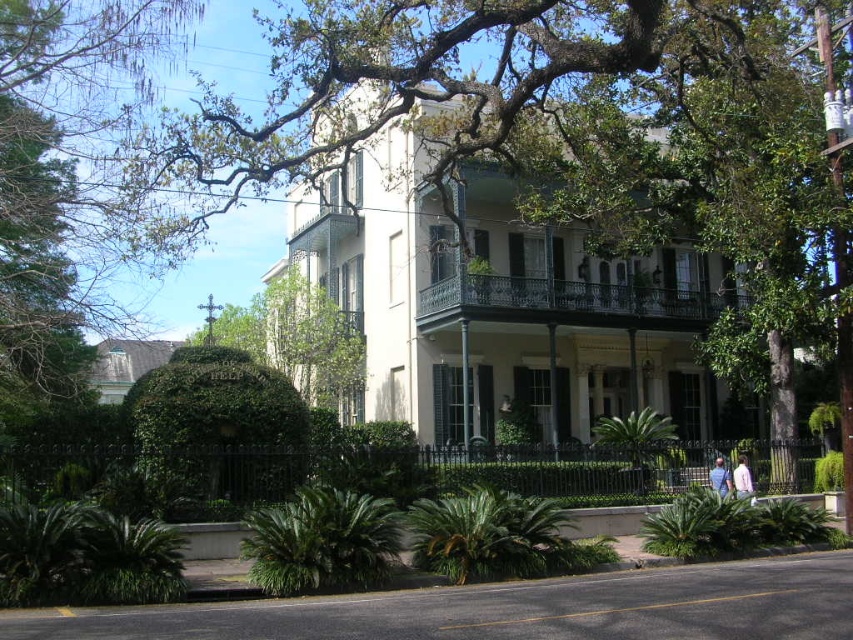
Question: Is dark green wrought iron porch at center positioned before pink fabric shirt at lower right?

Choices:
 (A) no
 (B) yes

Answer: (A)

Question: Can you confirm if dark green wrought iron porch at center is wider than pink fabric shirt at lower right?

Choices:
 (A) no
 (B) yes

Answer: (B)

Question: From the image, what is the correct spatial relationship of green leafy tree at center in relation to blue denim jacket at lower right?

Choices:
 (A) right
 (B) left

Answer: (B)

Question: Which object appears farthest from the camera in this image?

Choices:
 (A) blue denim jacket at lower right
 (B) green leafy tree at center
 (C) pink fabric shirt at lower right

Answer: (A)

Question: Estimate the real-world distances between objects in this image. Which object is farther from the green leafy tree at center?

Choices:
 (A) dark green wrought iron porch at center
 (B) green leafy tree at upper left
 (C) pink fabric shirt at lower right

Answer: (C)

Question: Which object appears farthest from the camera in this image?

Choices:
 (A) dark green wrought iron porch at center
 (B) blue denim jacket at lower right

Answer: (A)